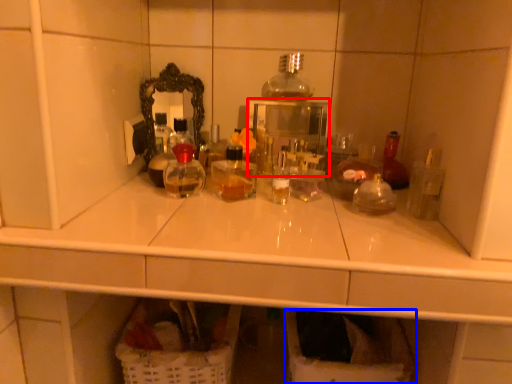
Question: Which point is closer to the camera, medicine cabinet (highlighted by a red box) or laundry basket (highlighted by a blue box)?

Choices:
 (A) medicine cabinet
 (B) laundry basket

Answer: (B)